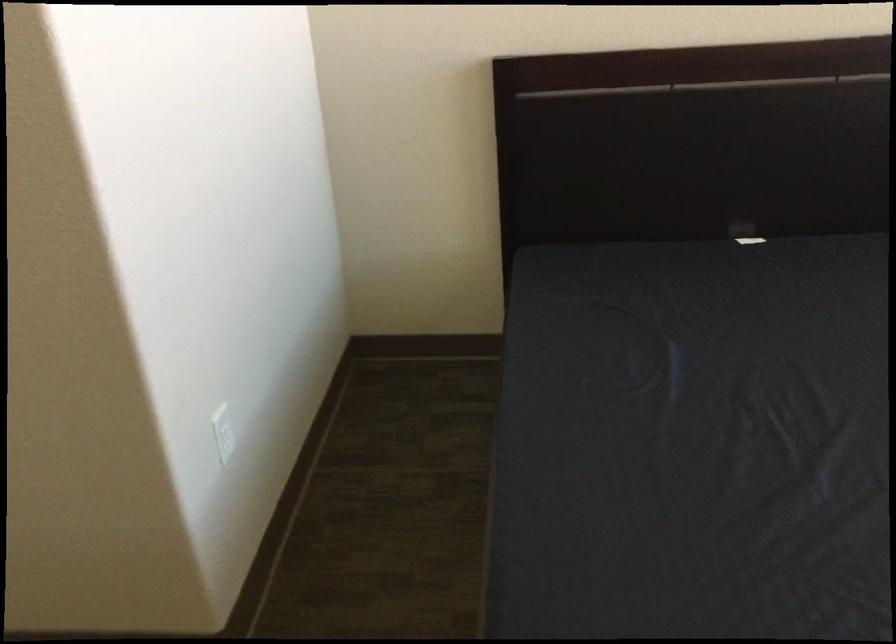
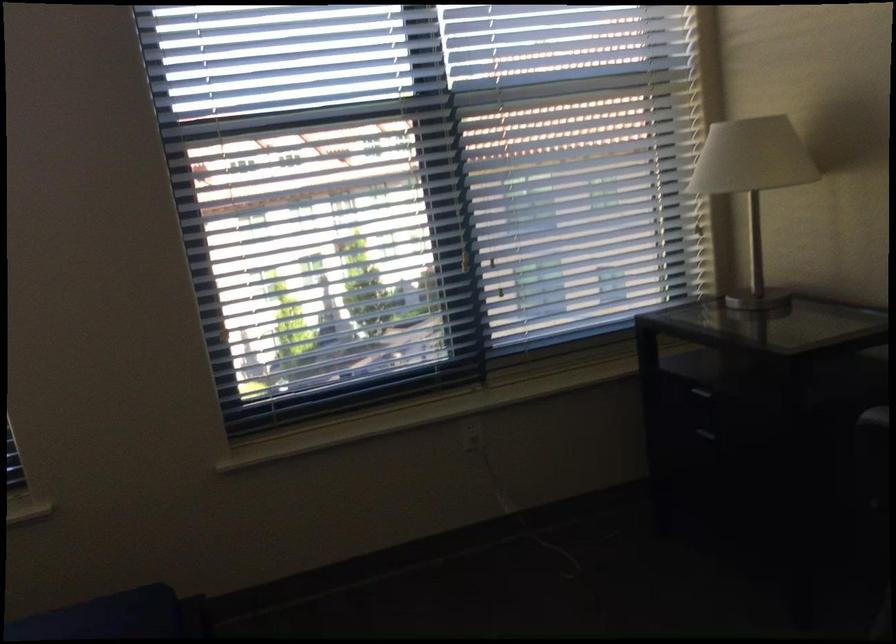
How did the camera likely rotate?

The camera rotated toward right-down.